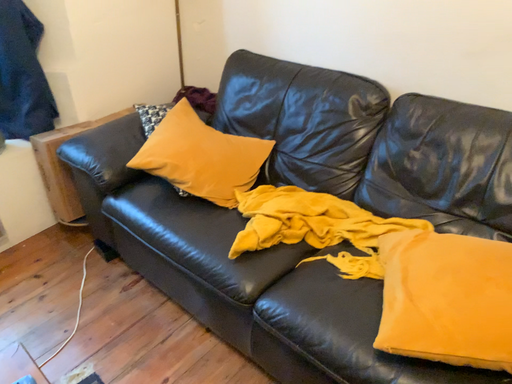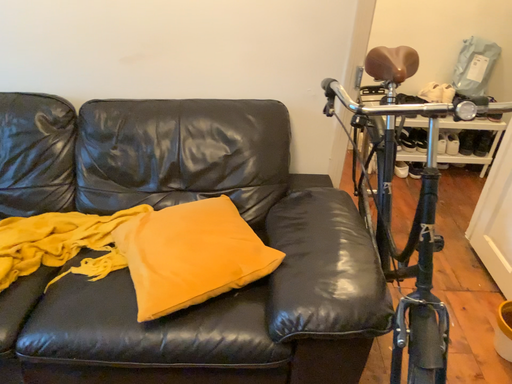
Question: How did the camera likely rotate when shooting the video?

Choices:
 (A) rotated downward
 (B) rotated upward

Answer: (B)